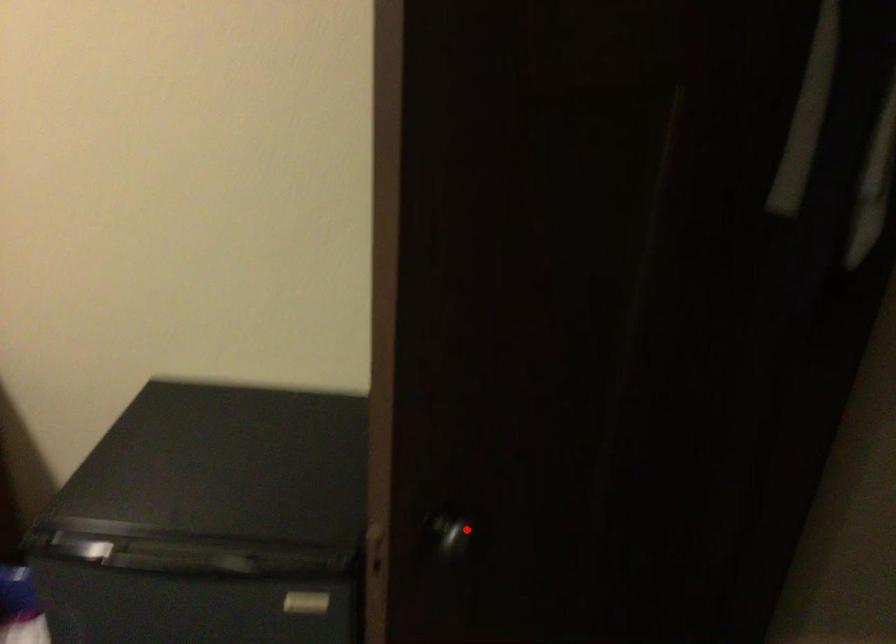
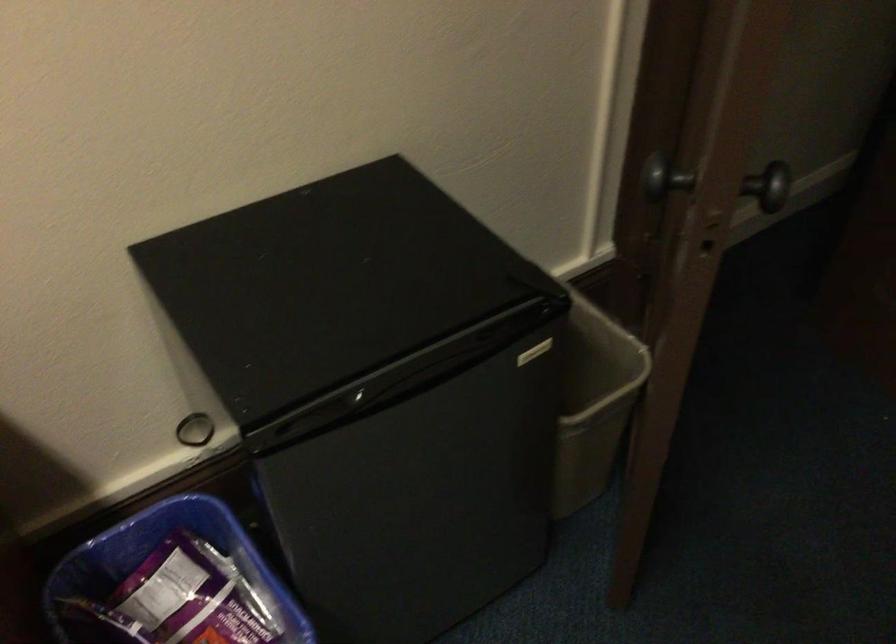
The point at the highlighted location is marked in the first image. Where is the corresponding point in the second image?

(771, 185)